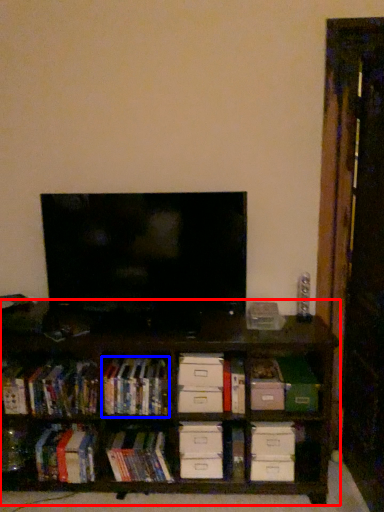
Question: Among these objects, which one is nearest to the camera, shelf (highlighted by a red box) or book (highlighted by a blue box)?

Choices:
 (A) shelf
 (B) book

Answer: (A)